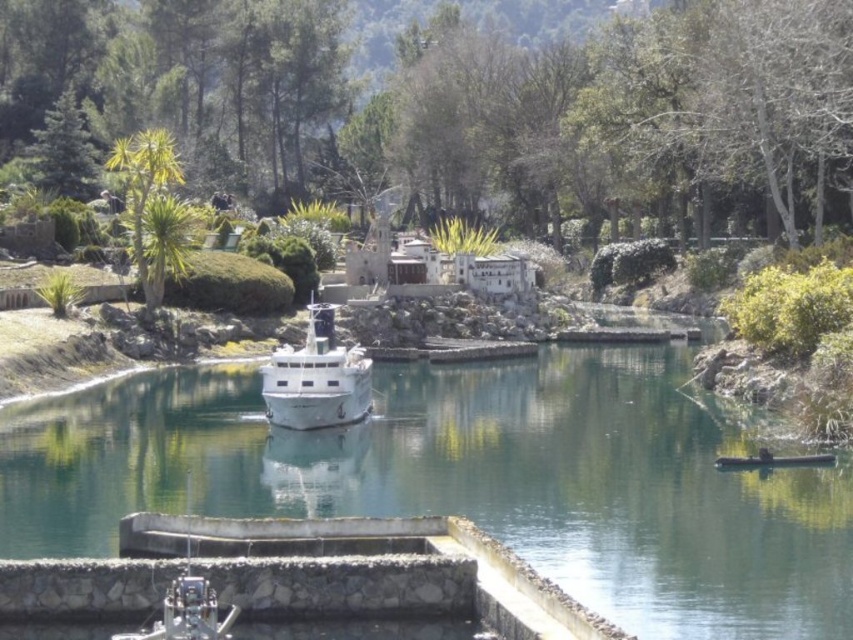
You are a tiny explorer standing on the deck of the model ship docked at the pier. You want to reach the green leafy tree at upper center. Which direction should you move to get closer to it?

The green leafy tree at upper center is located at point (457,109), so you should move towards the upper center direction to reach it.